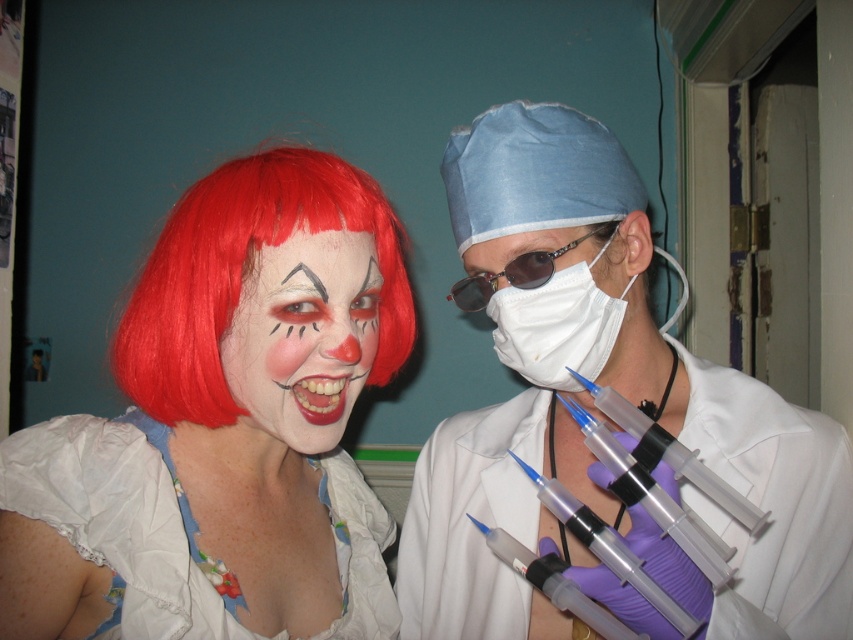
Question: Which object is positioned closest to the red synthetic wig at left?

Choices:
 (A) transparent plastic syringes at center
 (B) white fabric mask at center
 (C) transparent plastic syringe at lower right
 (D) white floral fabric dress at lower left

Answer: (D)

Question: Is white matte syringe at center positioned at the back of white floral fabric dress at lower left?

Choices:
 (A) no
 (B) yes

Answer: (A)

Question: Is white fabric mask at center positioned behind transparent plastic syringes at center?

Choices:
 (A) no
 (B) yes

Answer: (B)

Question: Which is farther from the white floral fabric dress at lower left?

Choices:
 (A) sunglassestransparent at right
 (B) transparent plastic syringes at lower right

Answer: (B)

Question: Which of the following is the farthest from the observer?

Choices:
 (A) (618, 566)
 (B) (685, 461)

Answer: (B)

Question: In this image, where is white matte syringe at center located relative to white floral fabric dress at lower left?

Choices:
 (A) below
 (B) above

Answer: (B)